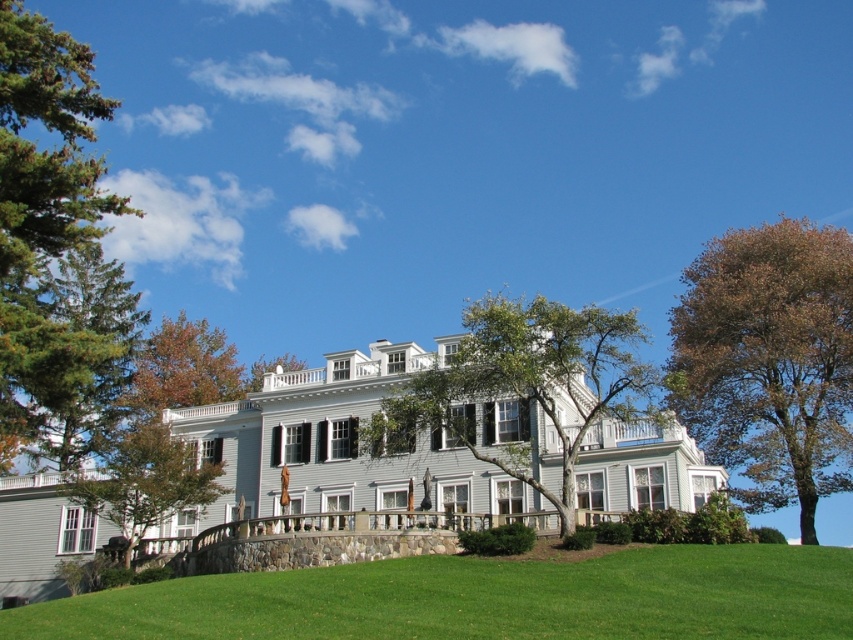
You are standing at the entrance of the house and want to walk towards the point marked as point (154, 486). Which direction should you move relative to point (489, 388)?

To reach point (154, 486) from the entrance, you should move behind point (489, 388) since point (489, 388) is in front of point (154, 486).

You are standing at the front entrance of the house and want to plant a new tree in your garden. You have two options for where to plant it. The first option is to plant it where the green leafy tree at center currently stands, and the second option is to plant it where the green leafy tree at lower left is. Which location currently has a tree that takes up more space in the garden?

The green leafy tree at center currently takes up more space in the garden as it is larger in size than the green leafy tree at lower left.